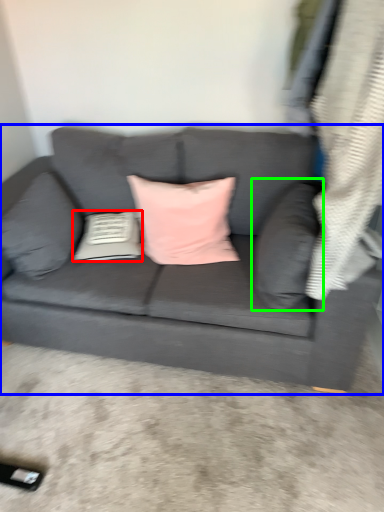
Question: Which is nearer to the pillow (highlighted by a red box)? studio couch (highlighted by a blue box) or pillow (highlighted by a green box).

Choices:
 (A) studio couch
 (B) pillow

Answer: (A)